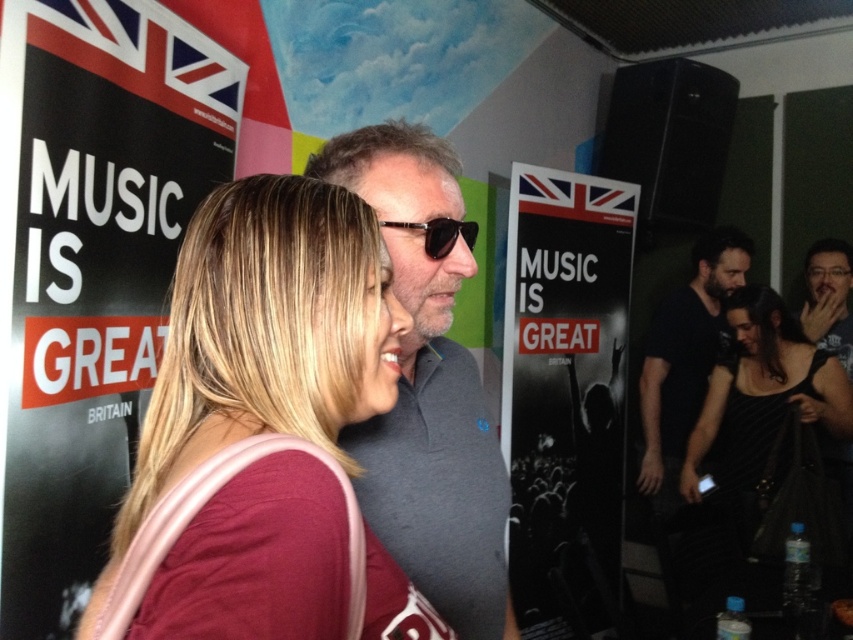
Question: Is the position of matte pink shirt at center less distant than that of black paper poster at upper left?

Choices:
 (A) yes
 (B) no

Answer: (A)

Question: Which of the following is the farthest from the observer?

Choices:
 (A) (838, 547)
 (B) (680, 458)

Answer: (B)

Question: Which point is closer to the camera taking this photo?

Choices:
 (A) (820, 340)
 (B) (596, 282)
 (C) (444, 212)

Answer: (C)

Question: Considering the relative positions of black paper poster at center and dark blue fabric shirt at right in the image provided, where is black paper poster at center located with respect to dark blue fabric shirt at right?

Choices:
 (A) below
 (B) above

Answer: (A)

Question: Is black paper poster at center further to camera compared to black matte shirt at right?

Choices:
 (A) yes
 (B) no

Answer: (B)

Question: Which of the following is the farthest from the observer?

Choices:
 (A) matte pink shirt at center
 (B) black reflective sunglasses at center

Answer: (B)